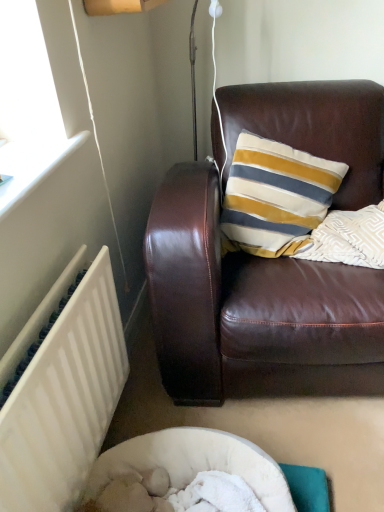
Identify the location of white painted radiator at lower left. (64, 399).

This screenshot has width=384, height=512. Describe the element at coordinates (64, 399) in the screenshot. I see `white painted radiator at lower left` at that location.

Measure the distance between point [314,282] and camera.

4.27 feet.

You are a GUI agent. You are given a task and a screenshot of the screen. Output one action in this format:
    pyautogui.click(x=<x>, y=<y>)
    Task: Click on the brown leather couch at upper right
    Image resolution: width=384 pixels, height=512 pixels.
    Given the screenshot: What is the action you would take?
    pyautogui.click(x=252, y=309)

What do you see at coordinates (252, 309) in the screenshot? I see `brown leather couch at upper right` at bounding box center [252, 309].

Where is `white painted radiator at lower left`? The image size is (384, 512). white painted radiator at lower left is located at coordinates (64, 399).

Can you confirm if white painted radiator at lower left is positioned to the left of brown leather couch at upper right?

Yes.

In the image, is white painted radiator at lower left positioned in front of or behind brown leather couch at upper right?

white painted radiator at lower left is positioned closer to the viewer than brown leather couch at upper right.

Between point (69, 263) and point (257, 293), which one is positioned in front?

The point (69, 263) is more forward.

From the image's perspective, which one is positioned higher, white painted radiator at lower left or brown leather couch at upper right?

brown leather couch at upper right is shown above in the image.

From a real-world perspective, who is located lower, white painted radiator at lower left or brown leather couch at upper right?

white painted radiator at lower left, from a real-world perspective.

From the picture: Can you confirm if white painted radiator at lower left is thinner than brown leather couch at upper right?

Indeed, white painted radiator at lower left has a lesser width compared to brown leather couch at upper right.

Who is shorter, white painted radiator at lower left or brown leather couch at upper right?

white painted radiator at lower left.

Is white painted radiator at lower left bigger than brown leather couch at upper right?

Incorrect, white painted radiator at lower left is not larger than brown leather couch at upper right.

Is white painted radiator at lower left completely or partially outside of brown leather couch at upper right?

Yes.

Is white painted radiator at lower left not close to brown leather couch at upper right?

That's not correct — white painted radiator at lower left is a little close to brown leather couch at upper right.

Is white painted radiator at lower left oriented away from brown leather couch at upper right?

That's not correct — white painted radiator at lower left is not looking away from brown leather couch at upper right.

Measure the distance from white painted radiator at lower left to brown leather couch at upper right.

A distance of 16.64 inches exists between white painted radiator at lower left and brown leather couch at upper right.

At what (x,y) coordinates should I click in order to perform the action: click on studio couch that is above the white painted radiator at lower left (from the image's perspective). Please return your answer as a coordinate pair (x, y). The width and height of the screenshot is (384, 512). Looking at the image, I should click on (252, 309).

Is brown leather couch at upper right to the left or to the right of white painted radiator at lower left in the image?

In the image, brown leather couch at upper right appears on the right side of white painted radiator at lower left.

Which is behind, brown leather couch at upper right or white painted radiator at lower left?

Positioned behind is brown leather couch at upper right.

Is point (339, 131) farther from camera compared to point (53, 507)?

Yes.

From the image's perspective, who appears lower, brown leather couch at upper right or white painted radiator at lower left?

white painted radiator at lower left appears lower in the image.

From a real-world perspective, is brown leather couch at upper right over white painted radiator at lower left?

Yes, from a real-world perspective, brown leather couch at upper right is on top of white painted radiator at lower left.

Can you confirm if brown leather couch at upper right is wider than white painted radiator at lower left?

Correct, the width of brown leather couch at upper right exceeds that of white painted radiator at lower left.

Is brown leather couch at upper right taller or shorter than white painted radiator at lower left?

Clearly, brown leather couch at upper right is taller compared to white painted radiator at lower left.

Considering the sizes of brown leather couch at upper right and white painted radiator at lower left in the image, is brown leather couch at upper right bigger or smaller than white painted radiator at lower left?

Considering their sizes, brown leather couch at upper right takes up more space than white painted radiator at lower left.

Is white painted radiator at lower left inside brown leather couch at upper right?

No, white painted radiator at lower left is not inside brown leather couch at upper right.

Is brown leather couch at upper right touching white painted radiator at lower left?

They are not placed beside each other.

Could you tell me if brown leather couch at upper right is facing white painted radiator at lower left?

No, brown leather couch at upper right is not aimed at white painted radiator at lower left.

How many degrees apart are the facing directions of brown leather couch at upper right and white painted radiator at lower left?

The angular difference between brown leather couch at upper right and white painted radiator at lower left is 84.2 degrees.

Find the location of a particular element. radiator in front of the brown leather couch at upper right is located at coordinates (64, 399).

The height and width of the screenshot is (512, 384). Find the location of `radiator below the brown leather couch at upper right (from a real-world perspective)`. radiator below the brown leather couch at upper right (from a real-world perspective) is located at coordinates (64, 399).

The image size is (384, 512). Find the location of `studio couch that is on the right side of white painted radiator at lower left`. studio couch that is on the right side of white painted radiator at lower left is located at coordinates (252, 309).